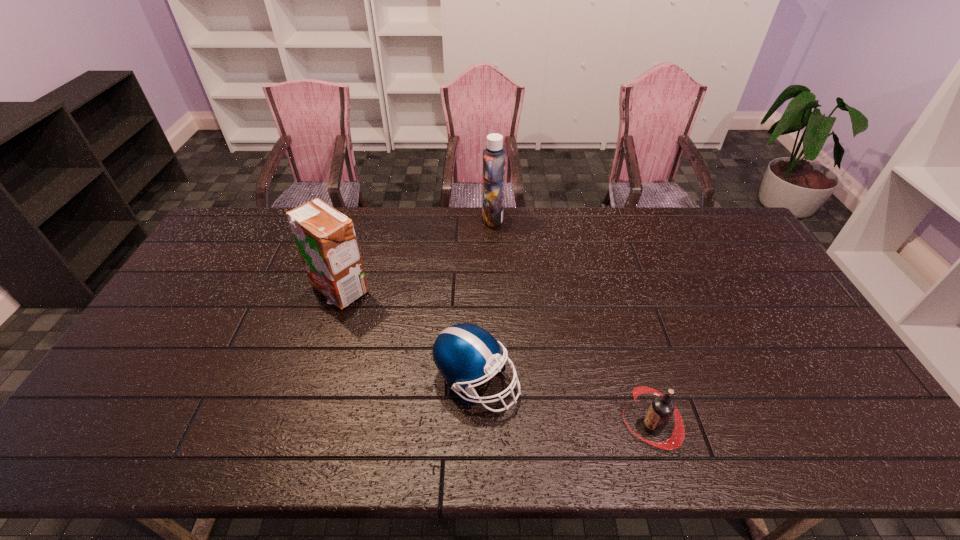
Where is `shampoo`? The image size is (960, 540). shampoo is located at coordinates (494, 156).

I want to click on carton, so click(x=326, y=240).

Identify the location of the third nearest object. (326, 240).

Where is `football helmet`? football helmet is located at coordinates tap(464, 354).

Locate an element on the screen. The height and width of the screenshot is (540, 960). the rightmost object is located at coordinates (661, 409).

The image size is (960, 540). I want to click on blank area located 0.110m on the front label of the shampoo, so click(x=453, y=218).

I want to click on blank space located 0.130m on the front label of the shampoo, so click(447, 218).

Locate an element on the screen. This screenshot has height=540, width=960. free region located 0.210m on the front label of the shampoo is located at coordinates (426, 218).

Locate an element on the screen. The width and height of the screenshot is (960, 540). vacant area located 0.250m on the straw side of the leftmost object is located at coordinates (309, 385).

Identify the location of vacant region located 0.290m at the front of the football helmet with the faceguard. (631, 382).